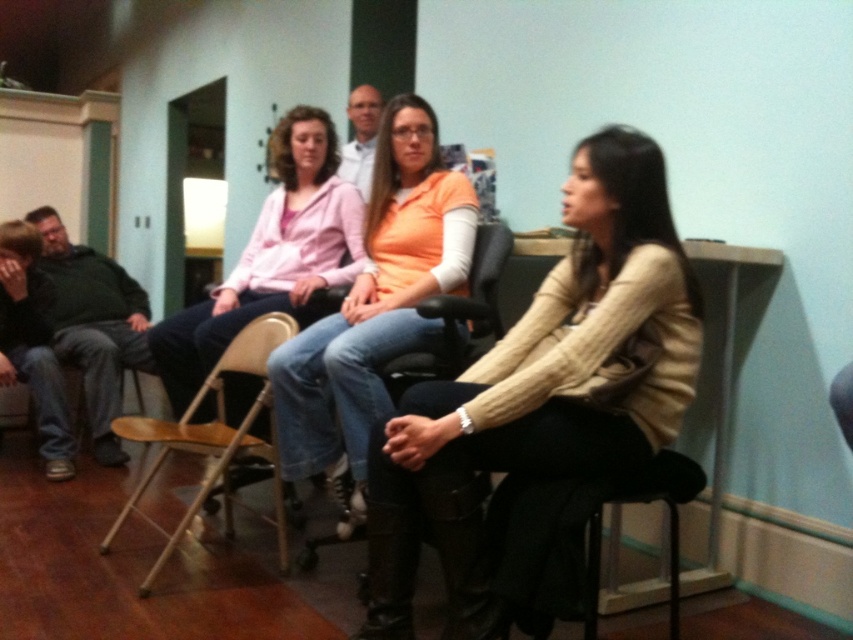
Question: From the image, what is the correct spatial relationship of matte orange sweater at center in relation to metallic gold chair at center?

Choices:
 (A) right
 (B) left

Answer: (A)

Question: Among these points, which one is farthest from the camera?

Choices:
 (A) (131, 424)
 (B) (68, 298)

Answer: (B)

Question: Does matte orange sweater at center have a greater width compared to dark green sweater at left?

Choices:
 (A) no
 (B) yes

Answer: (A)

Question: Which point is farther to the camera?

Choices:
 (A) (346, 520)
 (B) (370, 93)
 (C) (183, 324)

Answer: (B)

Question: Among these objects, which one is farthest from the camera?

Choices:
 (A) white matte shirt at center
 (B) metallic gold chair at center
 (C) knit beige sweater at center

Answer: (A)

Question: Does knit beige sweater at center appear over metallic gold chair at center?

Choices:
 (A) yes
 (B) no

Answer: (A)